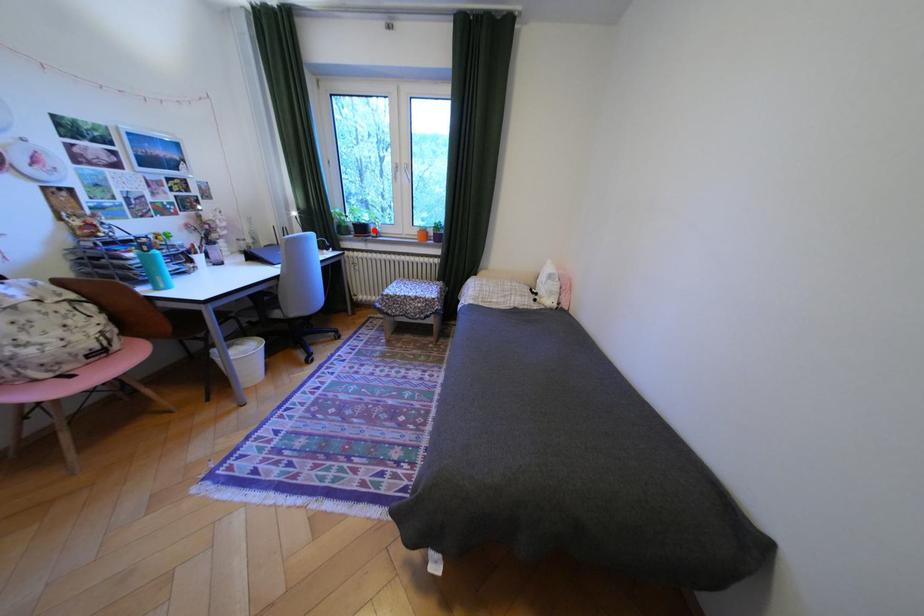
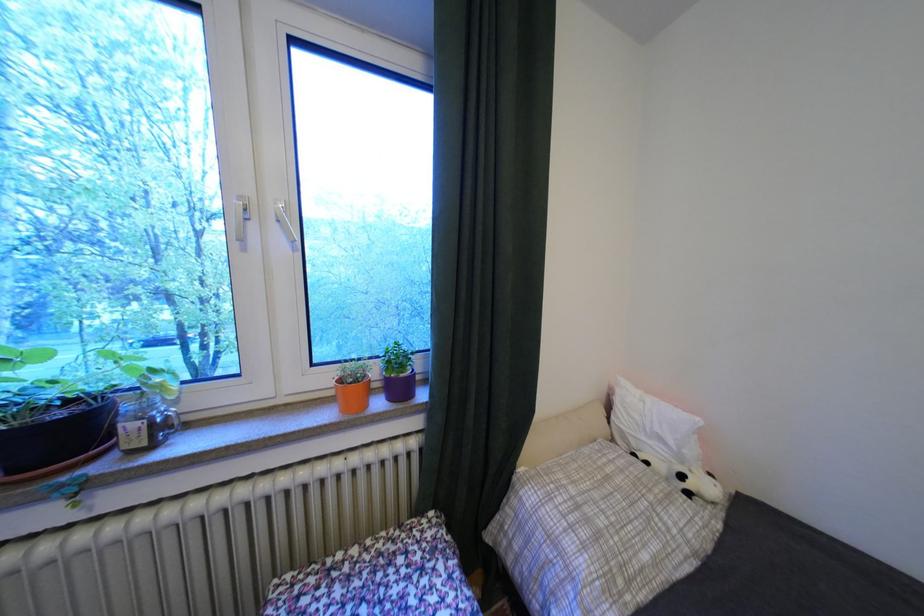
Question: I am providing you with two images of the same scene from different viewpoints. A red point is marked on the first image. Can you still see the location of the red point in image 2?

Choices:
 (A) Yes
 (B) No

Answer: (A)